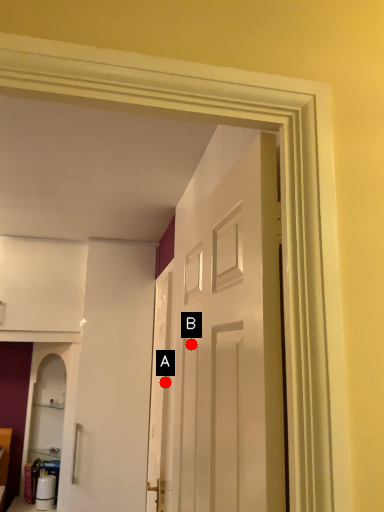
Question: Two points are circled on the image, labeled by A and B beside each circle. Which point is closer to the camera taking this photo?

Choices:
 (A) A is closer
 (B) B is closer

Answer: (B)